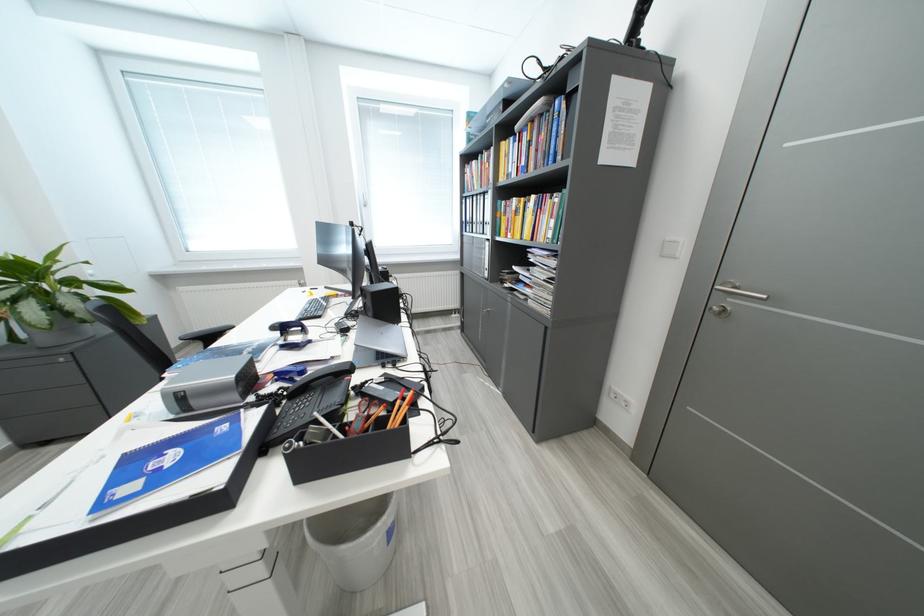
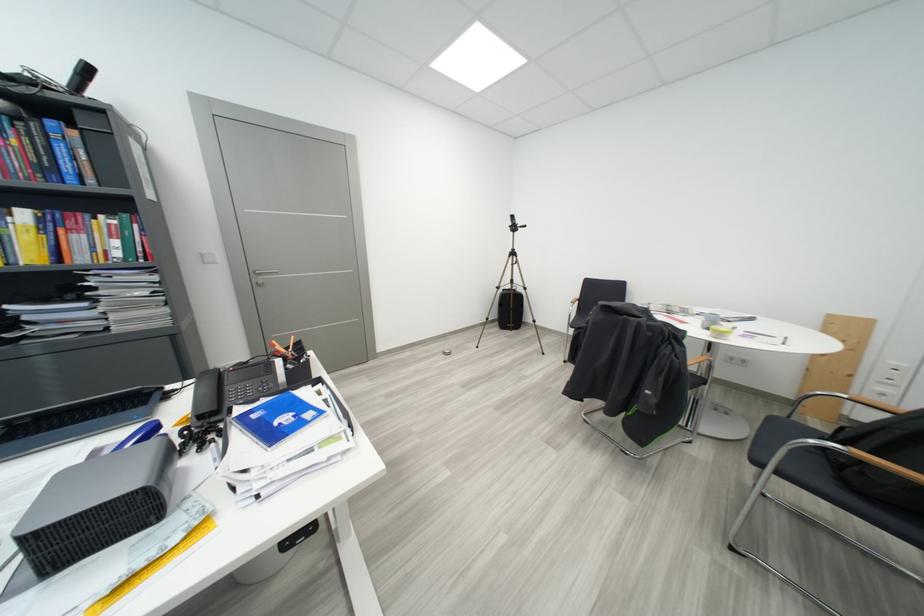
The point at [232,430] is marked in the first image. Where is the corresponding point in the second image?

(263, 419)